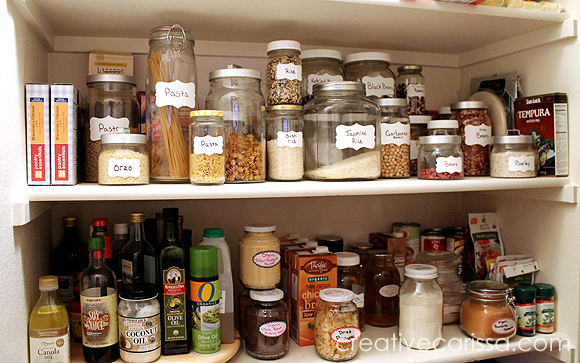
Locate an element on the screen. Image resolution: width=580 pixels, height=363 pixels. jars with plastic lids is located at coordinates (290, 42), (313, 50), (362, 50), (422, 120), (437, 122), (347, 263).